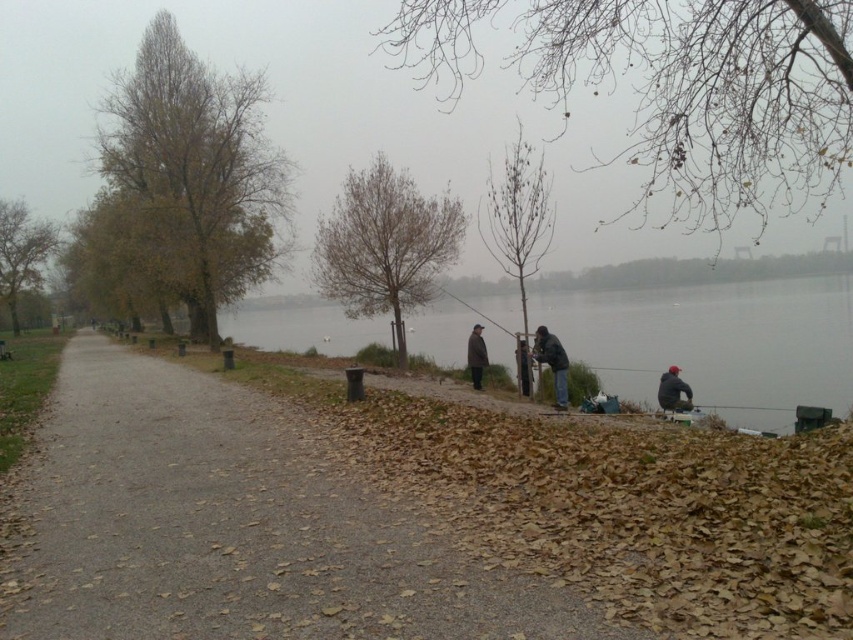
Is point (381, 624) in front of point (520, 388)?

That is True.

Can you confirm if brown gravel path at center is wider than dark gray jacket at center?

Yes, brown gravel path at center is wider than dark gray jacket at center.

Does point (97, 540) come in front of point (515, 358)?

That is True.

Identify the location of brown gravel path at center. The image size is (853, 640). (236, 528).

Does dark gray jacket at lower right have a lesser width compared to brown wool coat at center?

Yes, dark gray jacket at lower right is thinner than brown wool coat at center.

Does dark gray jacket at lower right have a larger size compared to brown wool coat at center?

No.

Does point (688, 403) come farther from viewer compared to point (473, 364)?

No, it is in front of (473, 364).

I want to click on dark gray jacket at lower right, so click(x=672, y=392).

Between gray concrete lake at lower right and dark gray jacket at center, which one appears on the left side from the viewer's perspective?

gray concrete lake at lower right is more to the left.

Is gray concrete lake at lower right thinner than dark gray jacket at center?

No, gray concrete lake at lower right is not thinner than dark gray jacket at center.

Find the location of `gray concrete lake at lower right`. gray concrete lake at lower right is located at coordinates (717, 342).